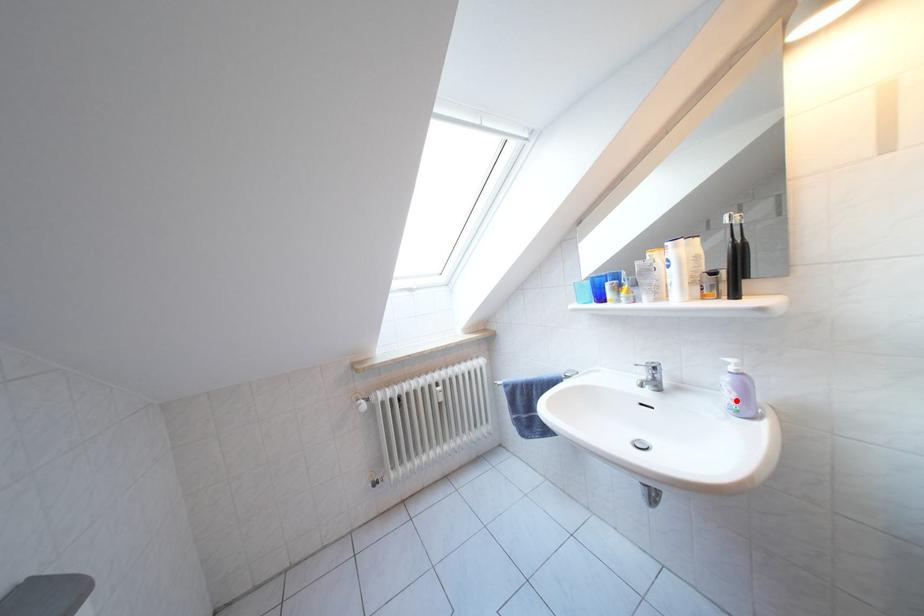
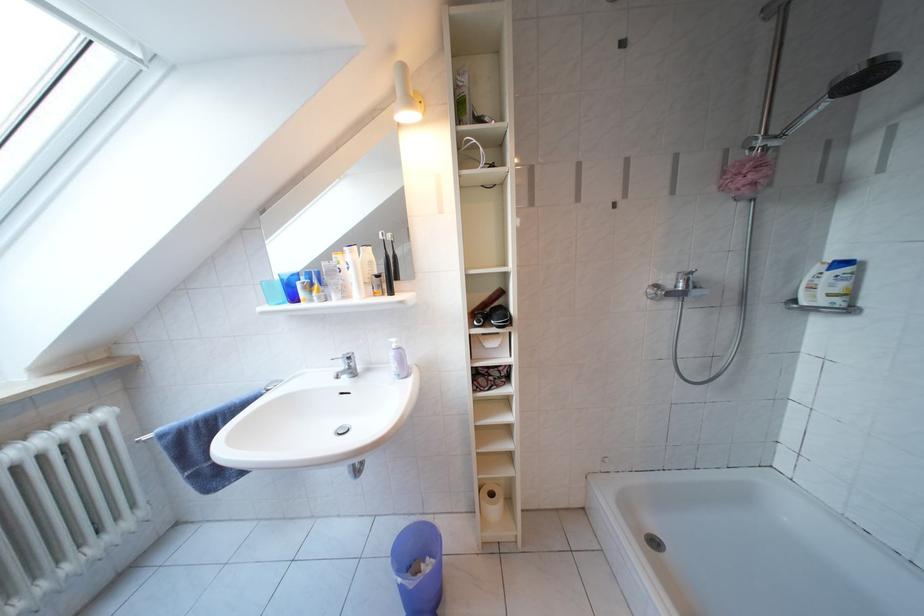
Locate, in the second image, the point that corresponds to the highlighted location in the first image.

(402, 371)